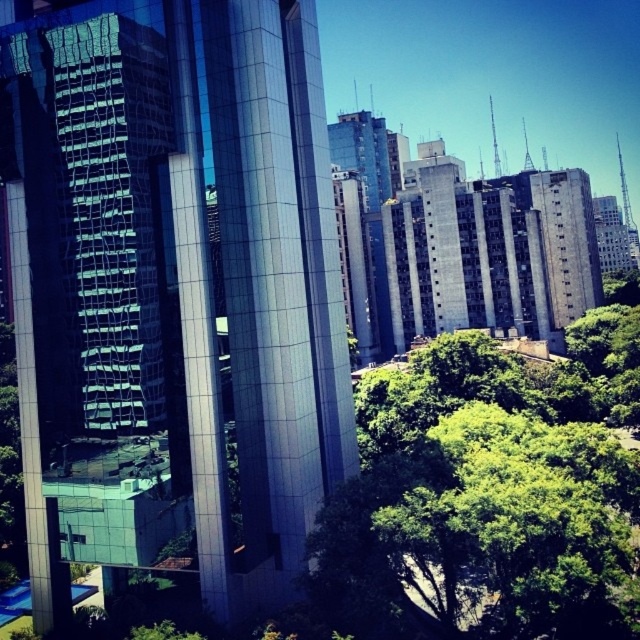
Question: Among these objects, which one is nearest to the camera?

Choices:
 (A) glossy glass building at center
 (B) green leafy tree at center

Answer: (B)

Question: Which point appears farthest from the camera in this image?

Choices:
 (A) (316, 70)
 (B) (556, 486)

Answer: (A)

Question: Is glossy glass building at center to the left of green leafy tree at center from the viewer's perspective?

Choices:
 (A) yes
 (B) no

Answer: (A)

Question: Can you confirm if glossy glass building at center is positioned to the left of green leafy tree at center?

Choices:
 (A) yes
 (B) no

Answer: (A)

Question: Does glossy glass building at center appear on the left side of green leafy tree at center?

Choices:
 (A) no
 (B) yes

Answer: (B)